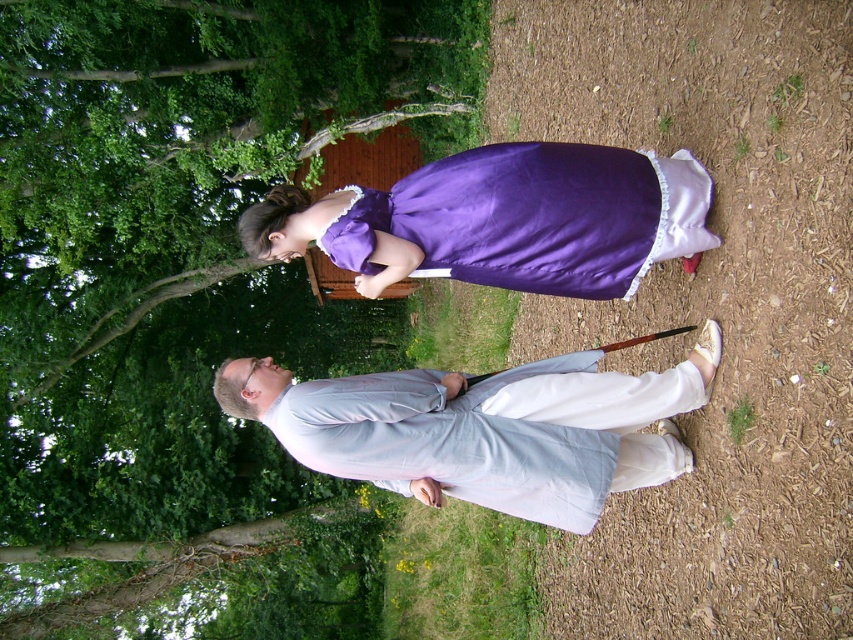
Consider the image. You are an archer aiming to shoot an arrow from the lower left corner of the image. You want to hit a target located at the lower right corner. Will the green leafy tree at upper center block your line of sight? Please provide your answer based on the coordinates provided in the description.

The green leafy tree at upper center is located at coordinates (180, 236). Since the arrow would travel from the lower left corner to the lower right corner, which are both at the bottom of the image, the tree at upper center is above the path of the arrow and will not block the line of sight.

You are an artist sketching the scene. You need to draw the green leafy tree at upper center and the purple satin dress at center. Which object should you draw first if you want to start with the one that is more to the left?

The green leafy tree at upper center should be drawn first because it is positioned on the left side of the purple satin dress at center.